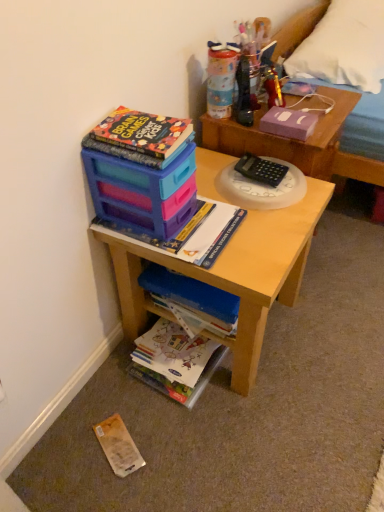
Image resolution: width=384 pixels, height=512 pixels. I want to click on blank space situated above matte plastic stack at upper center, arranged as the 3th book when ordered from the bottom (from a real-world perspective), so pos(174,226).